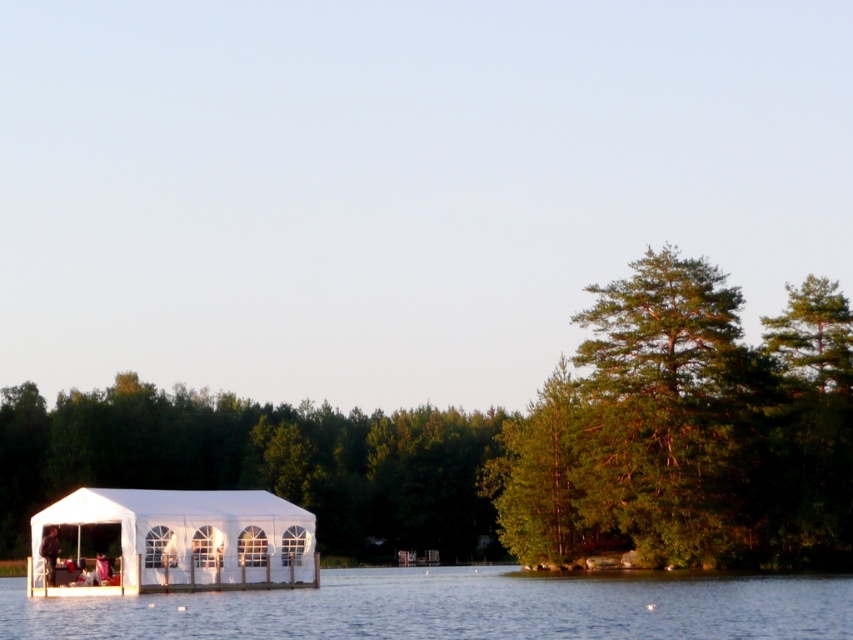
Can you confirm if green leafy tree at right is taller than green leafy tree at center?

Yes.

You are a GUI agent. You are given a task and a screenshot of the screen. Output one action in this format:
    pyautogui.click(x=<x>, y=<y>)
    Task: Click on the green leafy tree at right
    This screenshot has width=853, height=640.
    Given the screenshot: What is the action you would take?
    pyautogui.click(x=688, y=429)

At what (x,y) coordinates should I click in order to perform the action: click on green leafy tree at right. Please return your answer as a coordinate pair (x, y). The width and height of the screenshot is (853, 640). Looking at the image, I should click on 688,429.

Is transparent water at center to the right of white fabric tent at lower center from the viewer's perspective?

Yes, transparent water at center is to the right of white fabric tent at lower center.

Does transparent water at center appear on the left side of white fabric tent at lower center?

In fact, transparent water at center is to the right of white fabric tent at lower center.

Is point (369, 634) positioned in front of point (281, 509)?

Yes, it is.

This screenshot has height=640, width=853. Find the location of `transparent water at center`. transparent water at center is located at coordinates (456, 608).

Who is higher up, green leafy tree at right or white fabric tent at lower center?

green leafy tree at right

Identify the location of green leafy tree at right. The width and height of the screenshot is (853, 640). (688, 429).

What do you see at coordinates (688, 429) in the screenshot? I see `green leafy tree at right` at bounding box center [688, 429].

I want to click on green leafy tree at right, so click(x=688, y=429).